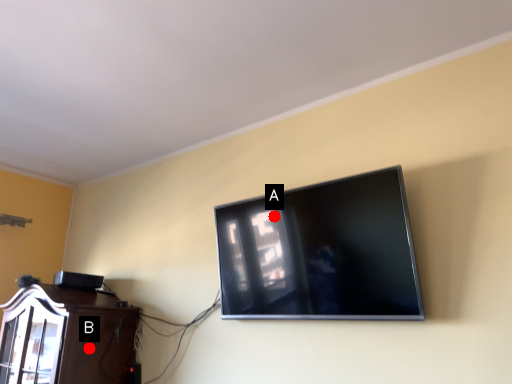
Question: Two points are circled on the image, labeled by A and B beside each circle. Which point is farther from the camera taking this photo?

Choices:
 (A) A is further
 (B) B is further

Answer: (B)